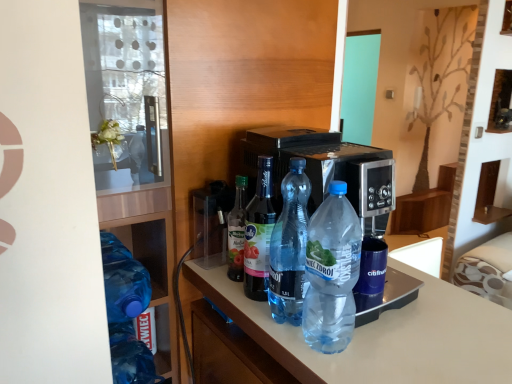
Question: Is clear plastic bottle at center, which appears as the 3th bottle when viewed from the right, facing towards transparent plastic bottle at center, which appears as the fourth bottle when viewed from the left?

Choices:
 (A) yes
 (B) no

Answer: (A)

Question: Does clear plastic bottle at center, which appears as the 3th bottle when viewed from the right, lie in front of transparent plastic bottle at center, the 2th bottle when ordered from right to left?

Choices:
 (A) no
 (B) yes

Answer: (A)

Question: Is clear plastic bottle at center, marked as the 3th bottle in a left-to-right arrangement, bigger than transparent plastic bottle at center, which appears as the fourth bottle when viewed from the left?

Choices:
 (A) no
 (B) yes

Answer: (B)

Question: Does clear plastic bottle at center, marked as the 3th bottle in a left-to-right arrangement, have a lesser width compared to transparent plastic bottle at center, the 2th bottle when ordered from right to left?

Choices:
 (A) no
 (B) yes

Answer: (A)

Question: Considering the relative sizes of clear plastic bottle at center, marked as the 3th bottle in a left-to-right arrangement, and transparent plastic bottle at center, which appears as the fourth bottle when viewed from the left, in the image provided, is clear plastic bottle at center, marked as the 3th bottle in a left-to-right arrangement, wider than transparent plastic bottle at center, which appears as the fourth bottle when viewed from the left,?

Choices:
 (A) no
 (B) yes

Answer: (B)

Question: Is clear plastic bottle at center, which appears as the 3th bottle when viewed from the right, next to transparent plastic bottle at center, which appears as the fourth bottle when viewed from the left?

Choices:
 (A) yes
 (B) no

Answer: (A)

Question: Is transparent plastic bottles at left completely or partially outside of translucent plastic bottle at center, which is the second bottle in left-to-right order?

Choices:
 (A) yes
 (B) no

Answer: (A)

Question: Considering the relative sizes of transparent plastic bottles at left and translucent plastic bottle at center, placed as the 4th bottle when sorted from right to left, in the image provided, is transparent plastic bottles at left shorter than translucent plastic bottle at center, placed as the 4th bottle when sorted from right to left,?

Choices:
 (A) no
 (B) yes

Answer: (A)

Question: Can you confirm if transparent plastic bottles at left is positioned to the right of translucent plastic bottle at center, placed as the 4th bottle when sorted from right to left?

Choices:
 (A) yes
 (B) no

Answer: (B)

Question: Is transparent plastic bottles at left thinner than translucent plastic bottle at center, which is the second bottle in left-to-right order?

Choices:
 (A) yes
 (B) no

Answer: (B)

Question: Is transparent plastic bottles at left behind translucent plastic bottle at center, which is the second bottle in left-to-right order?

Choices:
 (A) no
 (B) yes

Answer: (A)

Question: Is transparent plastic bottles at left closer to camera compared to translucent plastic bottle at center, which is the second bottle in left-to-right order?

Choices:
 (A) yes
 (B) no

Answer: (A)

Question: From a real-world perspective, is transparent plastic bottle at center, which appears as the fifth bottle when viewed from the left, over translucent plastic bottle at center, placed as the 4th bottle when sorted from right to left?

Choices:
 (A) no
 (B) yes

Answer: (B)